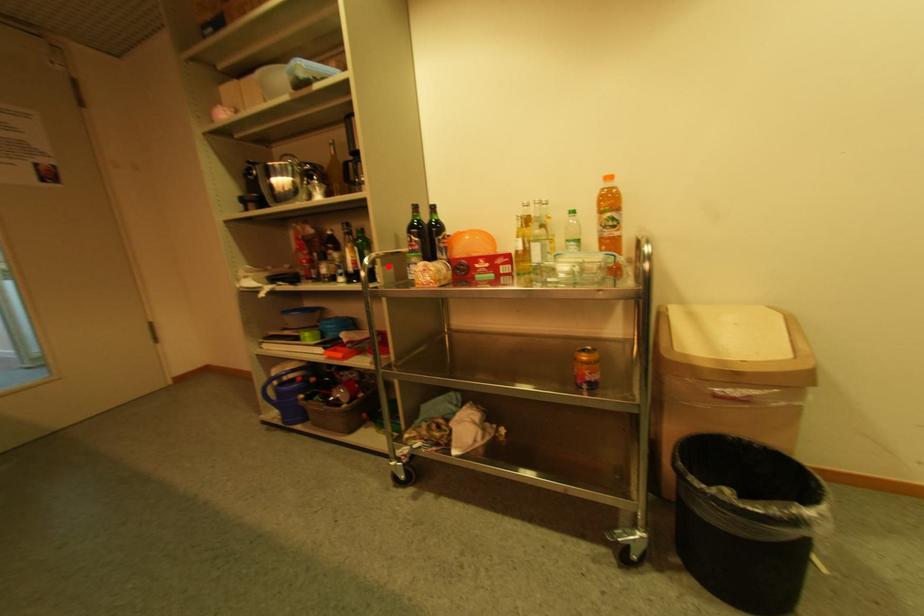
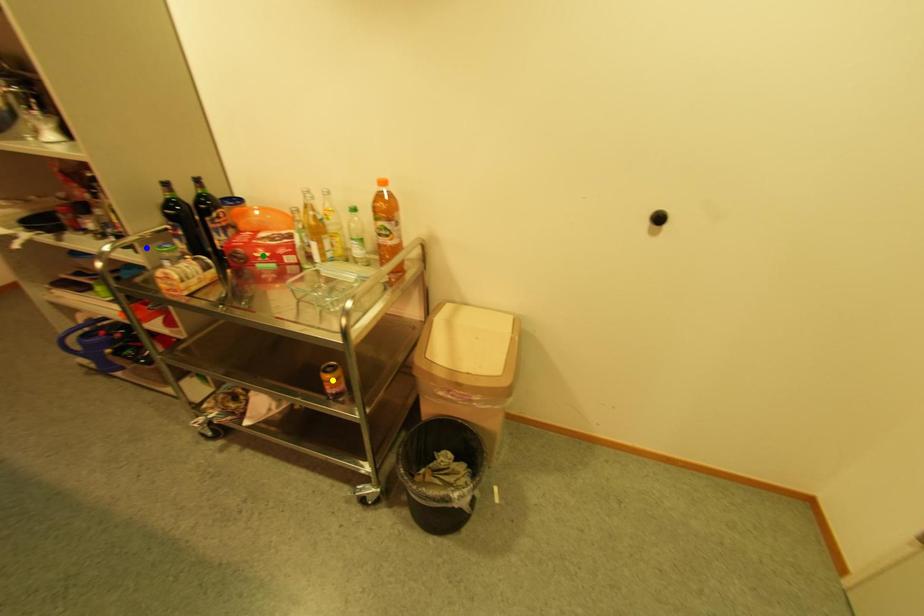
Question: I am providing you with two images of the same scene from different viewpoints. A red point is marked on the first image. You are given multiple points on the second image. Which mark in image 2 goes with the point in image 1?

Choices:
 (A) blue point
 (B) yellow point
 (C) green point

Answer: (A)